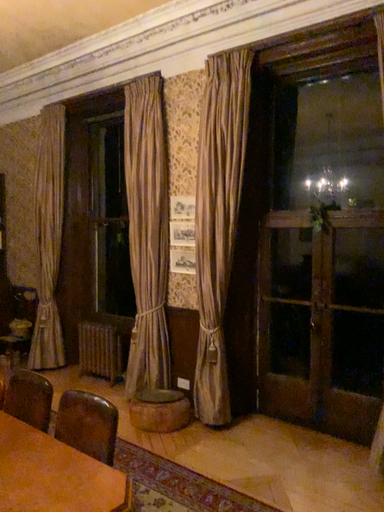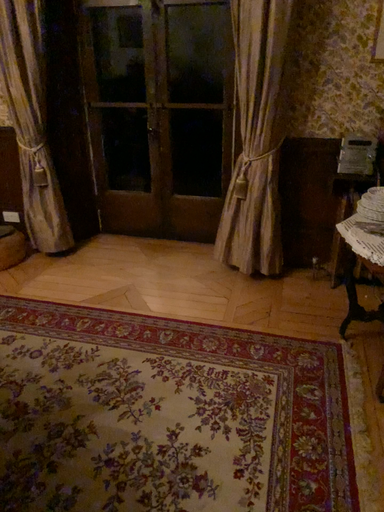
Question: Which way did the camera rotate in the video?

Choices:
 (A) rotated right
 (B) rotated left

Answer: (A)